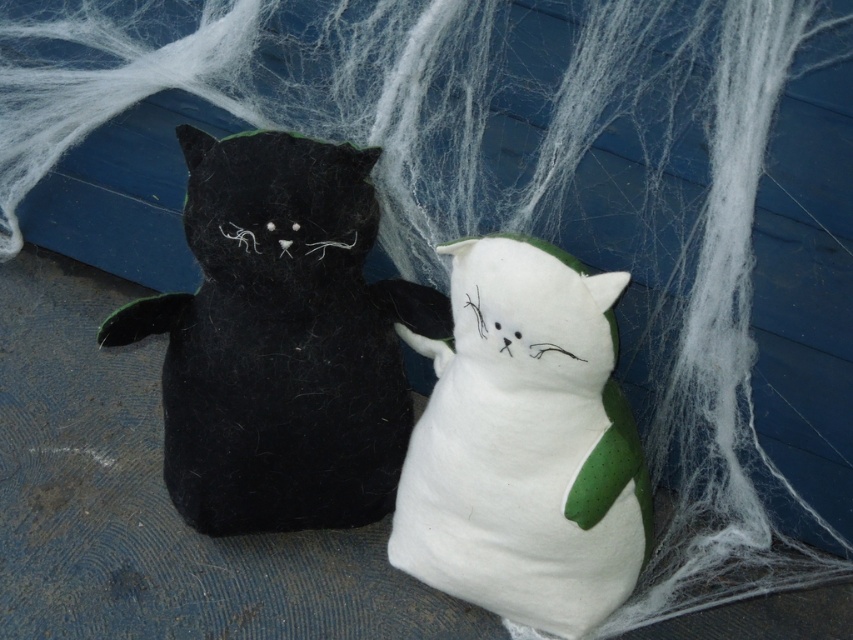
Looking at this image, which is above, matte black plush cat at left or white felt cat at center?

Positioned higher is matte black plush cat at left.

Consider the image. Between matte black plush cat at left and white felt cat at center, which one appears on the left side from the viewer's perspective?

matte black plush cat at left

Is point (389, 388) positioned before point (527, 580)?

No, (389, 388) is further to viewer.

Where is `matte black plush cat at left`? matte black plush cat at left is located at coordinates (281, 340).